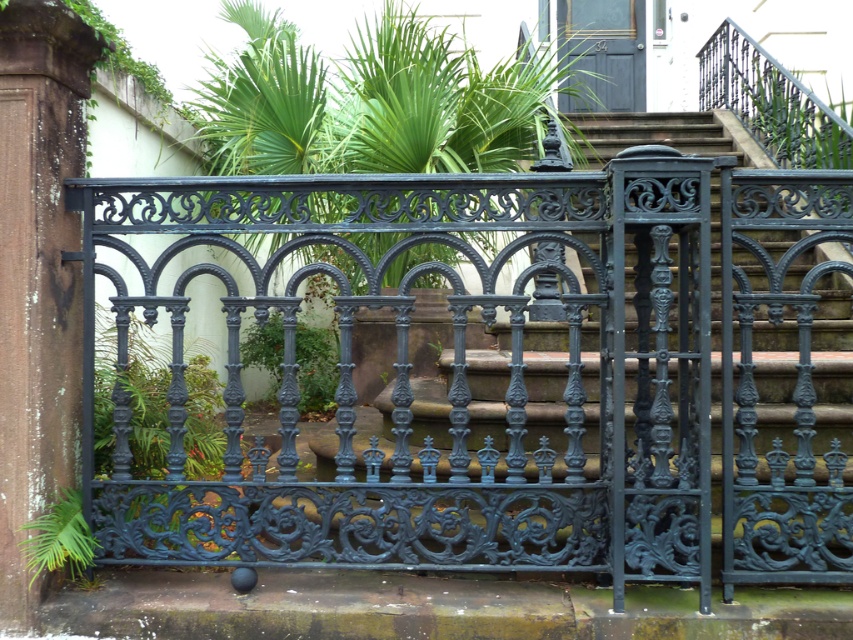
Can you confirm if green leafy plant at center is positioned below green leafy plant at lower left?

Incorrect, green leafy plant at center is not positioned below green leafy plant at lower left.

In the scene shown: Can you confirm if green leafy plant at center is bigger than green leafy plant at lower left?

Yes, green leafy plant at center is bigger than green leafy plant at lower left.

Locate an element on the screen. green leafy plant at center is located at coordinates (154, 408).

This screenshot has height=640, width=853. What do you see at coordinates (503, 369) in the screenshot?
I see `glossy wrought iron gate at center` at bounding box center [503, 369].

Is point (439, 230) closer to viewer compared to point (189, 388)?

Yes, point (439, 230) is in front of point (189, 388).

Is point (553, 548) less distant than point (109, 536)?

Yes, it is.

Where is `glossy wrought iron gate at center`? glossy wrought iron gate at center is located at coordinates (503, 369).

Is glossy wrought iron gate at center to the right of green matte plant at center from the viewer's perspective?

Indeed, glossy wrought iron gate at center is positioned on the right side of green matte plant at center.

Does glossy wrought iron gate at center lie in front of green matte plant at center?

Yes, glossy wrought iron gate at center is in front of green matte plant at center.

Describe the element at coordinates (503, 369) in the screenshot. The image size is (853, 640). I see `glossy wrought iron gate at center` at that location.

Find the location of `glossy wrought iron gate at center`. glossy wrought iron gate at center is located at coordinates (503, 369).